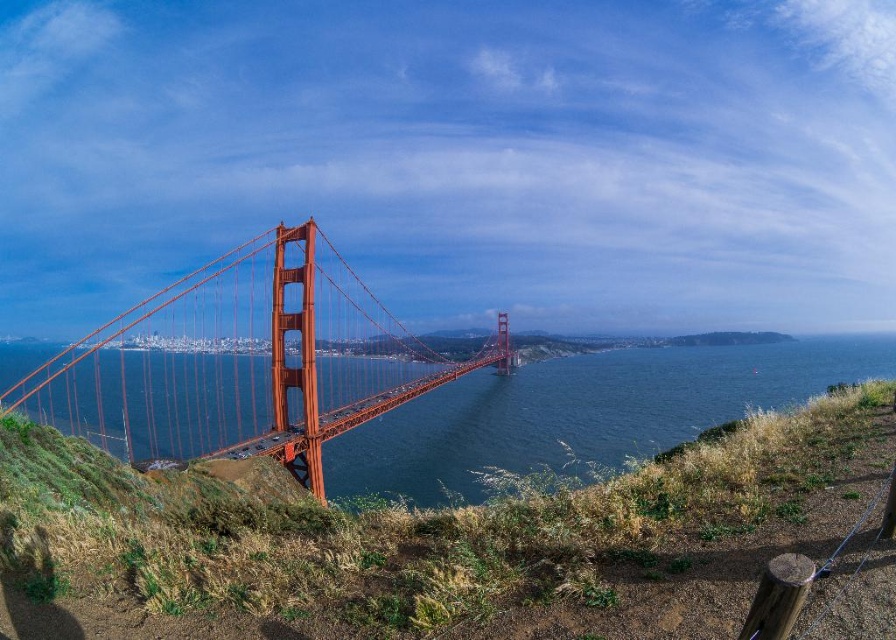
Who is lower down, bright orange bridge at center or transparent blue water at center?

transparent blue water at center is below.

Between bright orange bridge at center and transparent blue water at center, which one has more height?

bright orange bridge at center is taller.

At what (x,y) coordinates should I click in order to perform the action: click on bright orange bridge at center. Please return your answer as a coordinate pair (x, y). The image size is (896, 640). Looking at the image, I should click on (243, 362).